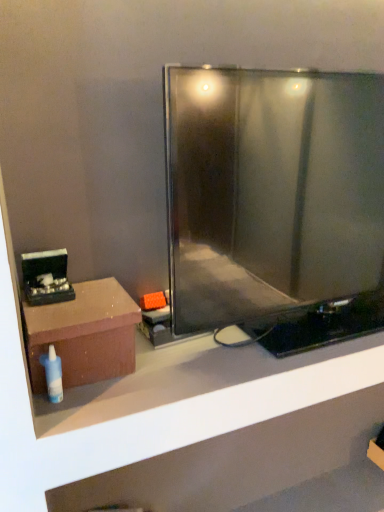
The width and height of the screenshot is (384, 512). In order to click on free point above matte brown box at left (from a real-world perspective) in this screenshot , I will do `click(77, 300)`.